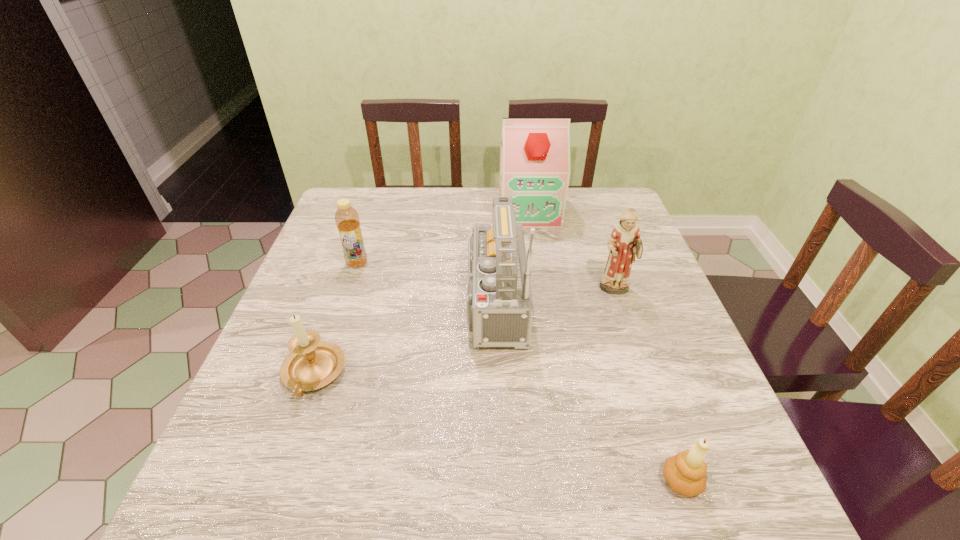
This screenshot has width=960, height=540. I want to click on vacant space that satisfies the following two spatial constraints: 1. on the front-facing side of the third tallest object; 2. on the right side of the shorter candle_holder, so click(x=679, y=481).

Where is `vacant space that satisfies the following two spatial constraints: 1. on the front-facing side of the figurine; 2. on the left side of the shorter candle_holder`? The width and height of the screenshot is (960, 540). vacant space that satisfies the following two spatial constraints: 1. on the front-facing side of the figurine; 2. on the left side of the shorter candle_holder is located at coordinates (679, 481).

At what (x,y) coordinates should I click in order to perform the action: click on vacant position in the image that satisfies the following two spatial constraints: 1. on the front-facing side of the right candle_holder; 2. on the left side of the figurine. Please return your answer as a coordinate pair (x, y). This screenshot has width=960, height=540. Looking at the image, I should click on (679, 481).

The height and width of the screenshot is (540, 960). In order to click on free location that satisfies the following two spatial constraints: 1. with a handle on the side of the farther candle_holder; 2. on the right side of the right candle_holder in this screenshot , I will do `click(276, 481)`.

You are a GUI agent. You are given a task and a screenshot of the screen. Output one action in this format:
    pyautogui.click(x=<x>, y=<y>)
    Task: Click on the free space in the image that satisfies the following two spatial constraints: 1. with the cap open on the farthest object; 2. on the left side of the right candle_holder
    Image resolution: width=960 pixels, height=540 pixels.
    Given the screenshot: What is the action you would take?
    pyautogui.click(x=570, y=481)